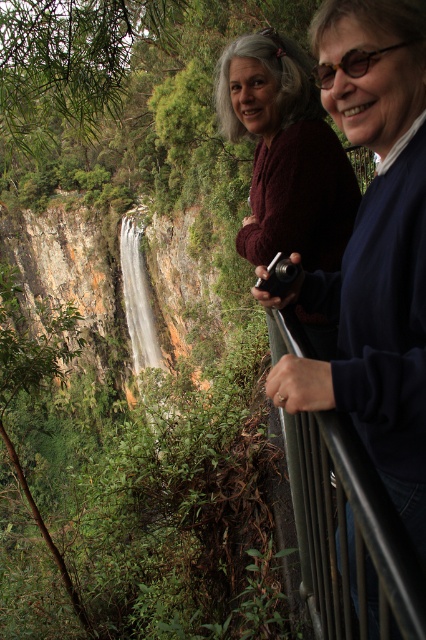
Question: Does matte black camera at upper right have a greater width compared to silver metallic camera at center?

Choices:
 (A) yes
 (B) no

Answer: (A)

Question: Which of the following is the closest to the observer?

Choices:
 (A) maroon sweater at upper center
 (B) silver metallic camera at center
 (C) matte black camera at upper right
 (D) black metal/rail at right

Answer: (D)

Question: In this image, where is matte black camera at upper right located relative to silver metallic camera at center?

Choices:
 (A) left
 (B) right

Answer: (B)

Question: Which object is positioned closest to the maroon sweater at upper center?

Choices:
 (A) matte black camera at upper right
 (B) black metal/rail at right

Answer: (A)

Question: Estimate the real-world distances between objects in this image. Which object is closer to the matte black camera at upper right?

Choices:
 (A) silver metallic camera at center
 (B) maroon sweater at upper center

Answer: (A)

Question: Is maroon sweater at upper center wider than silver metallic camera at center?

Choices:
 (A) no
 (B) yes

Answer: (B)